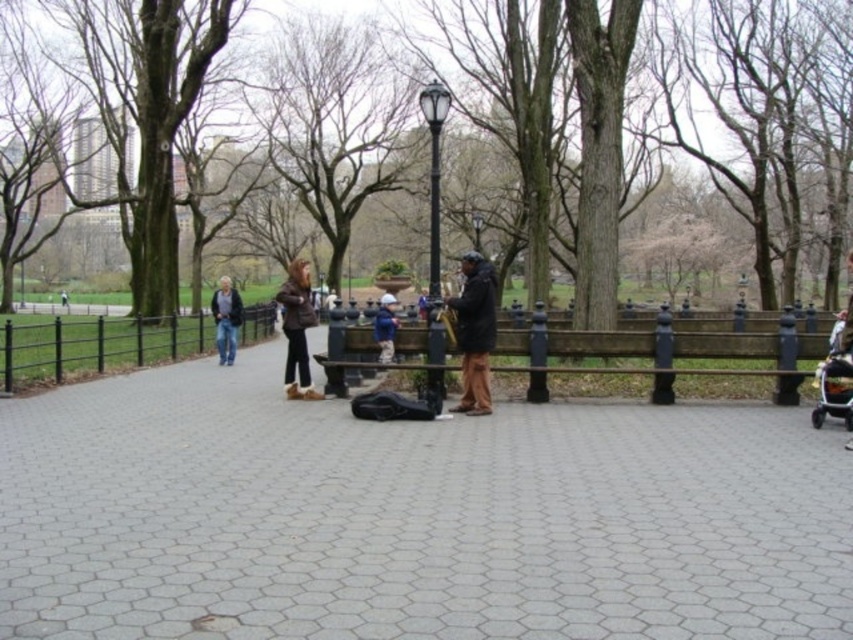
Is point (329, 368) closer to viewer compared to point (300, 349)?

Yes, it is in front of point (300, 349).

Between brown wooden bench at center and brown fuzzy jacket at center, which one appears on the left side from the viewer's perspective?

From the viewer's perspective, brown fuzzy jacket at center appears more on the left side.

This screenshot has width=853, height=640. Describe the element at coordinates (670, 346) in the screenshot. I see `brown wooden bench at center` at that location.

Locate an element on the screen. This screenshot has height=640, width=853. brown wooden bench at center is located at coordinates (670, 346).

Is brown fuzzy jacket at center to the left of jeans at center from the viewer's perspective?

Incorrect, brown fuzzy jacket at center is not on the left side of jeans at center.

Does brown fuzzy jacket at center appear under jeans at center?

Correct, brown fuzzy jacket at center is located below jeans at center.

Which is in front, point (300, 381) or point (225, 349)?

Point (300, 381)

The image size is (853, 640). What are the coordinates of `brown fuzzy jacket at center` in the screenshot? It's located at (297, 330).

Is black metal fence at left taller than dark brown leather jacket at center?

No.

Looking at this image, can you confirm if black metal fence at left is positioned to the left of dark brown leather jacket at center?

Indeed, black metal fence at left is positioned on the left side of dark brown leather jacket at center.

Is point (192, 337) behind point (456, 323)?

That is True.

Identify the location of black metal fence at left. The image size is (853, 640). point(96,346).